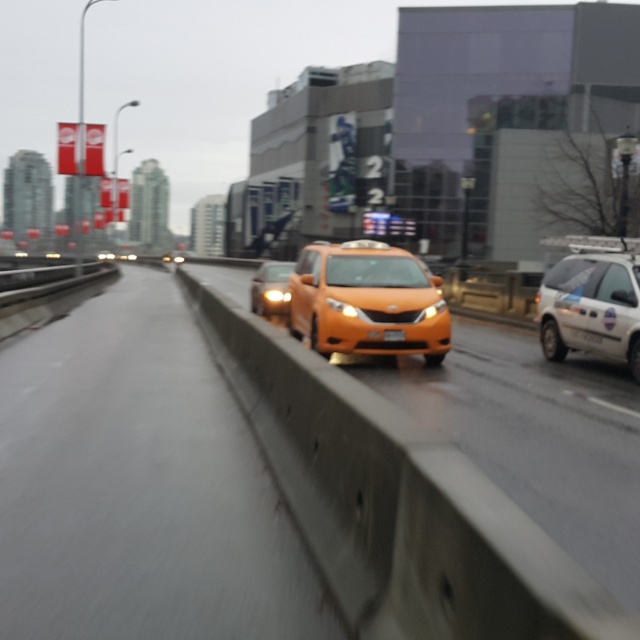
Between point (426, 289) and point (288, 275), which one is positioned in front?

Point (426, 289)

Does matte orange taxi at center have a smaller size compared to matte black sedan at center?

Yes.

This screenshot has width=640, height=640. I want to click on matte orange taxi at center, so pyautogui.click(x=365, y=301).

Where is `matte orange taxi at center`? matte orange taxi at center is located at coordinates (365, 301).

In the scene shown: Does orange matte car at center appear over yellow plastic license plate at center?

No.

Is point (458, 573) more distant than point (394, 330)?

No, it is not.

The width and height of the screenshot is (640, 640). In order to click on orange matte car at center in this screenshot , I will do `click(396, 502)`.

Which is above, matte orange taxi at center or yellow plastic license plate at center?

matte orange taxi at center

The width and height of the screenshot is (640, 640). I want to click on matte orange taxi at center, so click(365, 301).

Where is `matte orange taxi at center`? Image resolution: width=640 pixels, height=640 pixels. matte orange taxi at center is located at coordinates (365, 301).